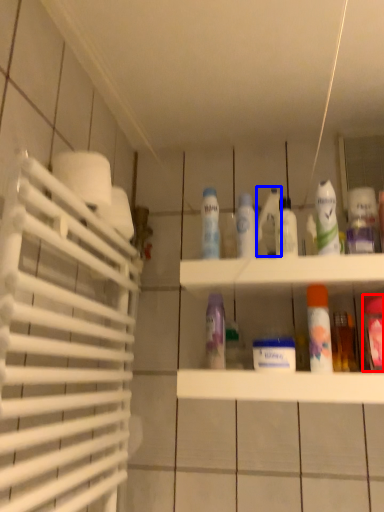
Question: Among these objects, which one is nearest to the camera, mouthwash (highlighted by a red box) or cleaning product (highlighted by a blue box)?

Choices:
 (A) mouthwash
 (B) cleaning product

Answer: (A)